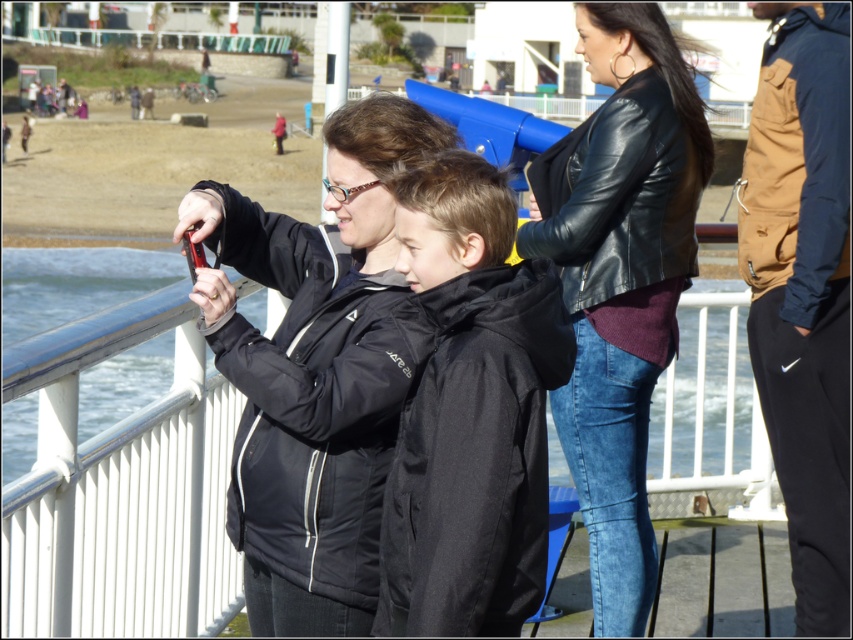
Can you confirm if black matte jacket at center is bigger than brown suede jacket at upper right?

Incorrect, black matte jacket at center is not larger than brown suede jacket at upper right.

Locate an element on the screen. black matte jacket at center is located at coordinates (469, 412).

The height and width of the screenshot is (640, 853). I want to click on black matte jacket at center, so click(469, 412).

Can you confirm if matte black jacket at center is shorter than brown suede jacket at upper right?

Yes.

Between point (213, 220) and point (778, 60), which one is positioned in front?

Point (213, 220)

Where is `matte black jacket at center`? This screenshot has width=853, height=640. matte black jacket at center is located at coordinates (315, 372).

Can you confirm if black leather jacket at center is positioned below brown suede jacket at upper right?

Correct, black leather jacket at center is located below brown suede jacket at upper right.

Consider the image. Is black leather jacket at center positioned at the back of brown suede jacket at upper right?

Yes, it is behind brown suede jacket at upper right.

Identify the location of black leather jacket at center. The height and width of the screenshot is (640, 853). (619, 278).